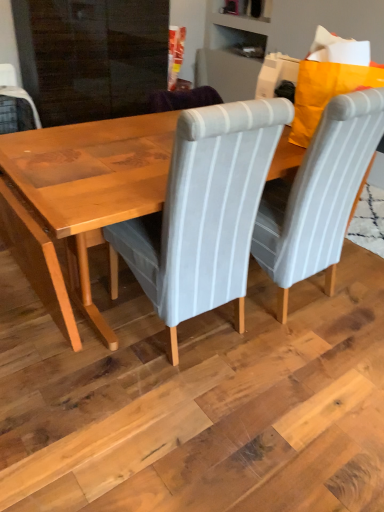
Question: Is light gray fabric chair at center, the 1th chair positioned from the left, at the back of gray striped fabric chair at center, which ranks as the second chair in left-to-right order?

Choices:
 (A) yes
 (B) no

Answer: (B)

Question: Is gray striped fabric chair at center, which ranks as the second chair in left-to-right order, in contact with light gray fabric chair at center, the 1th chair positioned from the left?

Choices:
 (A) no
 (B) yes

Answer: (A)

Question: Is gray striped fabric chair at center, the 1th chair in the right-to-left sequence, shorter than light gray fabric chair at center, the 1th chair positioned from the left?

Choices:
 (A) no
 (B) yes

Answer: (A)

Question: Does gray striped fabric chair at center, the 1th chair in the right-to-left sequence, have a greater height compared to light gray fabric chair at center, the 1th chair positioned from the left?

Choices:
 (A) yes
 (B) no

Answer: (A)

Question: From a real-world perspective, is gray striped fabric chair at center, the 1th chair in the right-to-left sequence, positioned under light gray fabric chair at center, the 1th chair positioned from the left, based on gravity?

Choices:
 (A) no
 (B) yes

Answer: (A)

Question: Choose the correct answer: Is light gray fabric chair at center, the 2th chair from the right, inside wooden table at center or outside it?

Choices:
 (A) inside
 (B) outside

Answer: (B)

Question: Is point (273, 100) positioned closer to the camera than point (109, 202)?

Choices:
 (A) farther
 (B) closer

Answer: (B)

Question: In terms of height, does light gray fabric chair at center, the 2th chair from the right, look taller or shorter compared to wooden table at center?

Choices:
 (A) tall
 (B) short

Answer: (A)

Question: From the image's perspective, relative to wooden table at center, is light gray fabric chair at center, the 2th chair from the right, above or below?

Choices:
 (A) above
 (B) below

Answer: (A)

Question: Visually, is wooden table at center positioned to the left or to the right of gray striped fabric chair at center, which ranks as the second chair in left-to-right order?

Choices:
 (A) right
 (B) left

Answer: (B)

Question: Considering their positions, is wooden table at center located in front of or behind gray striped fabric chair at center, the 1th chair in the right-to-left sequence?

Choices:
 (A) front
 (B) behind

Answer: (A)

Question: From the image's perspective, is wooden table at center located above or below gray striped fabric chair at center, the 1th chair in the right-to-left sequence?

Choices:
 (A) below
 (B) above

Answer: (A)

Question: Considering the positions of wooden table at center and gray striped fabric chair at center, which ranks as the second chair in left-to-right order, in the image, is wooden table at center bigger or smaller than gray striped fabric chair at center, which ranks as the second chair in left-to-right order,?

Choices:
 (A) small
 (B) big

Answer: (B)

Question: In the image, is wooden table at center on the left side or the right side of light gray fabric chair at center, the 2th chair from the right?

Choices:
 (A) right
 (B) left

Answer: (A)

Question: From the image's perspective, is wooden table at center positioned above or below light gray fabric chair at center, the 2th chair from the right?

Choices:
 (A) above
 (B) below

Answer: (B)